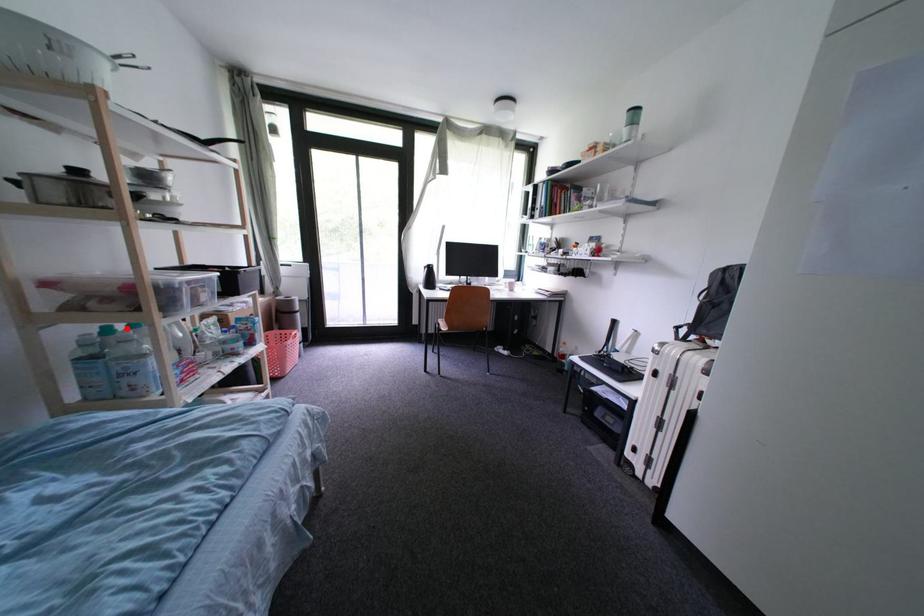
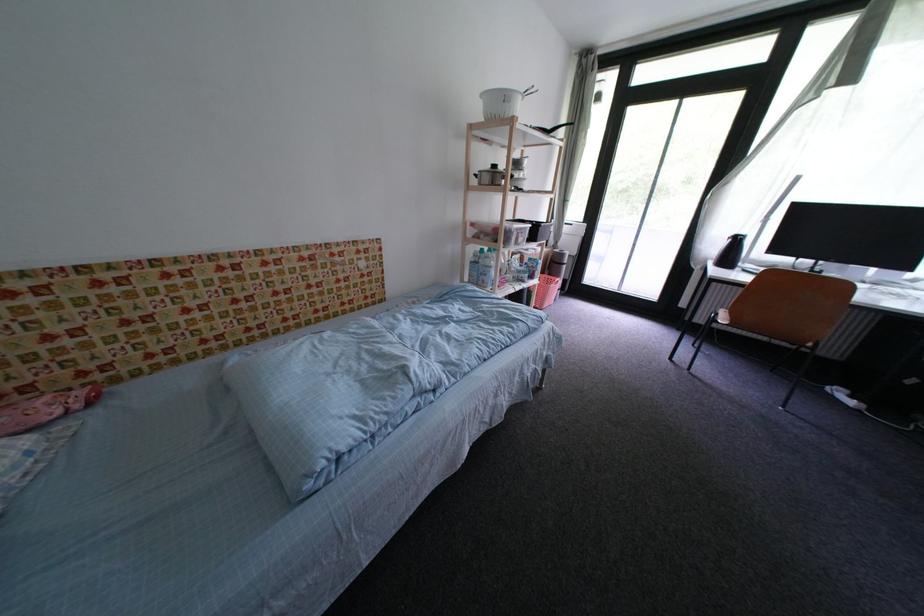
Question: I am providing you with two images of the same scene from different viewpoints. A red point is marked on the first image. At the location where the point appears in image 1, is it still visible in image 2?

Choices:
 (A) Yes
 (B) No

Answer: (A)